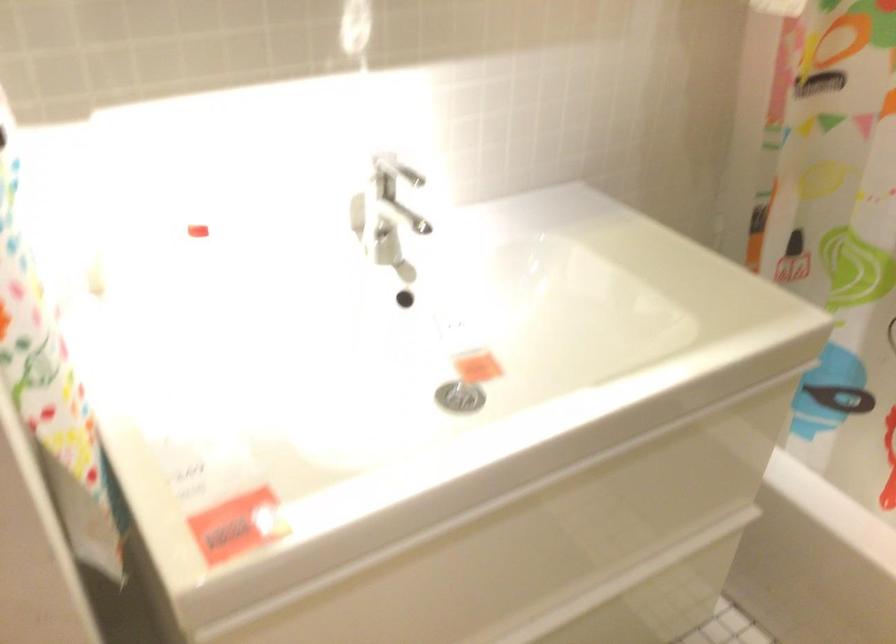
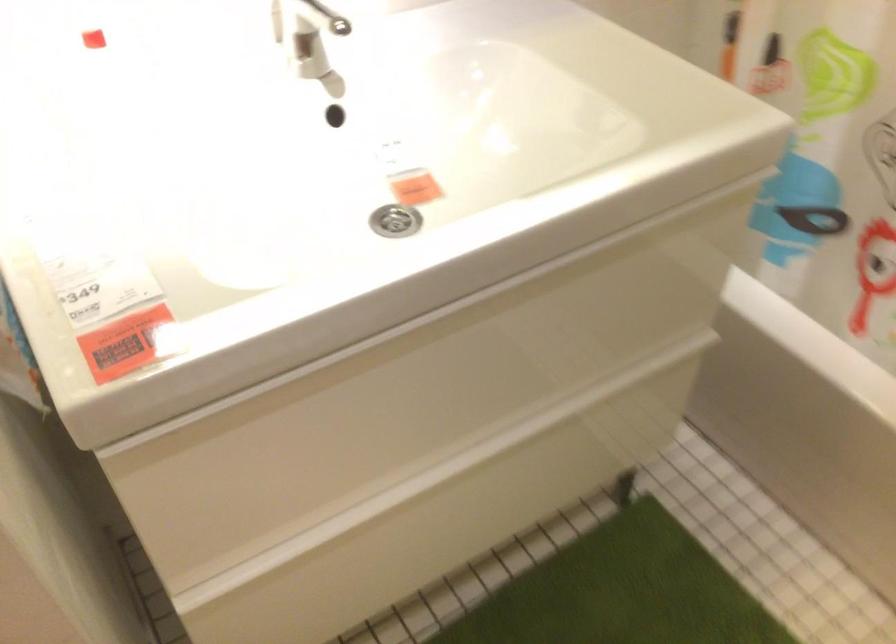
In the second image, find the point that corresponds to (490,572) in the first image.

(423, 392)